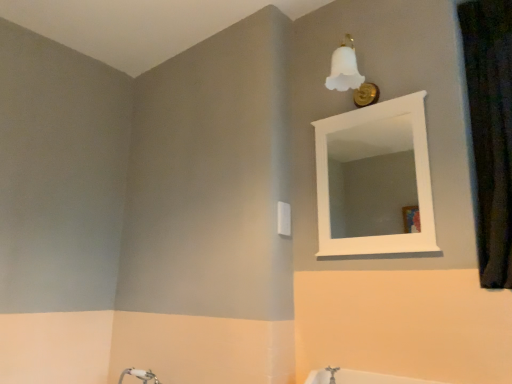
Question: Is black textured curtain at right aimed at white wooden mirror at upper center?

Choices:
 (A) no
 (B) yes

Answer: (A)

Question: Considering the relative sizes of black textured curtain at right and white wooden mirror at upper center in the image provided, is black textured curtain at right taller than white wooden mirror at upper center?

Choices:
 (A) no
 (B) yes

Answer: (B)

Question: Does black textured curtain at right have a larger size compared to white wooden mirror at upper center?

Choices:
 (A) no
 (B) yes

Answer: (B)

Question: From a real-world perspective, is black textured curtain at right physically above white wooden mirror at upper center?

Choices:
 (A) yes
 (B) no

Answer: (A)

Question: Is black textured curtain at right wider than white wooden mirror at upper center?

Choices:
 (A) no
 (B) yes

Answer: (B)

Question: From the image's perspective, would you say black textured curtain at right is positioned over white wooden mirror at upper center?

Choices:
 (A) no
 (B) yes

Answer: (B)

Question: Is white wooden mirror at upper center oriented towards black textured curtain at right?

Choices:
 (A) no
 (B) yes

Answer: (A)

Question: Is white wooden mirror at upper center oriented away from black textured curtain at right?

Choices:
 (A) no
 (B) yes

Answer: (A)

Question: From a real-world perspective, is white wooden mirror at upper center beneath black textured curtain at right?

Choices:
 (A) no
 (B) yes

Answer: (B)

Question: Is white wooden mirror at upper center in front of black textured curtain at right?

Choices:
 (A) yes
 (B) no

Answer: (B)

Question: From the image's perspective, does white wooden mirror at upper center appear lower than black textured curtain at right?

Choices:
 (A) yes
 (B) no

Answer: (A)

Question: Is white wooden mirror at upper center placed right next to black textured curtain at right?

Choices:
 (A) no
 (B) yes

Answer: (A)

Question: Looking at their shapes, would you say black textured curtain at right is wider or thinner than white wooden mirror at upper center?

Choices:
 (A) thin
 (B) wide

Answer: (B)